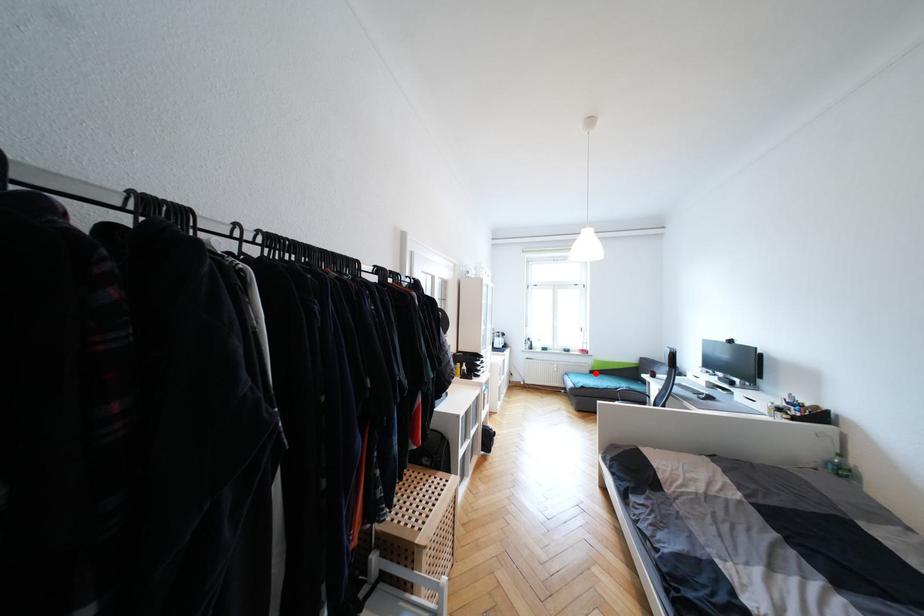
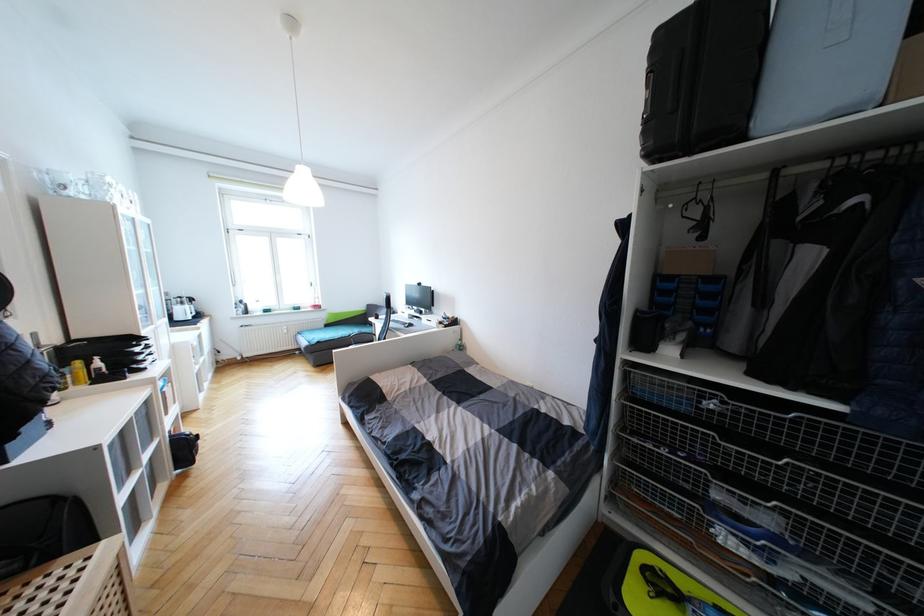
Where in the second image is the point corresponding to the highlighted location from the first image?

(331, 326)